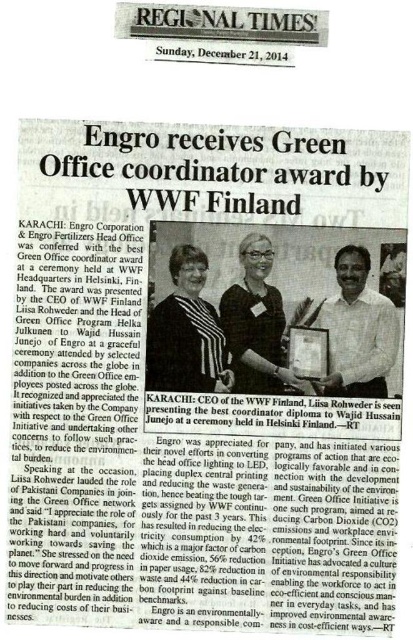
Based on the newspaper clipping from the Regional Times dated December 21, 2014, which point, point at [379,380] or point at [251,317], is closer to the camera?

Point at [251,317] is closer to the camera than point at [379,380].

You are standing in front of the newspaper clipping and notice a white shirt at center. If you want to read the headline, which is located at the top of the clipping, should you move closer or farther away from the clipping?

The white shirt at center is 16.59 feet away from viewer. To read the headline located at the top of the clipping, you should move closer to the clipping since the headline is part of the clipping and the current distance may be too far to read clearly.

A person is standing at the position of the viewer in the image. They want to reach the black striped dress at center without moving their feet. Is this possible?

The black striped dress at center is 4.96 meters away from viewer. Since the person cannot move their feet, they cannot physically reach the dress which is nearly 5 meters away.